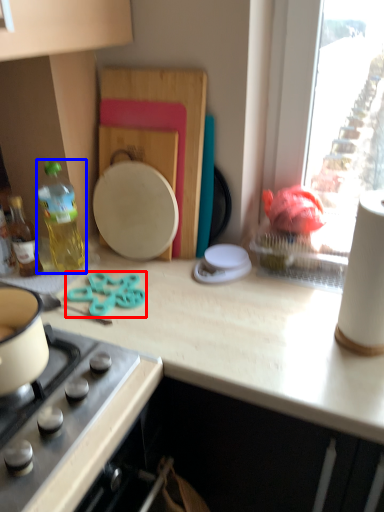
Question: Which object appears closest to the camera in this image, scissors (highlighted by a red box) or bottle (highlighted by a blue box)?

Choices:
 (A) scissors
 (B) bottle

Answer: (A)